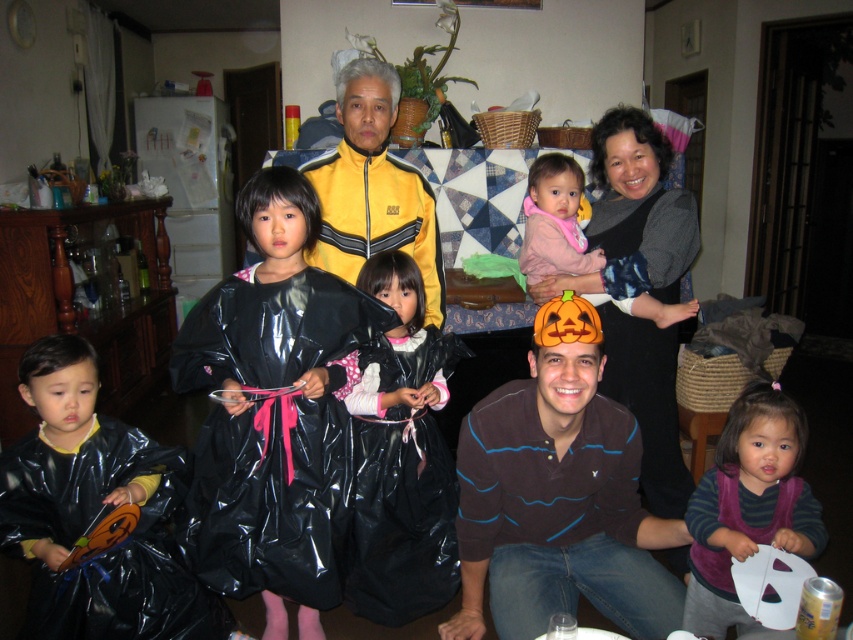
You are organizing a Halloween party and need to choose between the glossy black plastic bag at lower left and the shiny black plastic bag at center for holding candies. Which bag has a larger width?

The glossy black plastic bag at lower left has a larger width than the shiny black plastic bag at center.

You are a photographer standing 1.5 meters away from the camera. You want to take a photo of the brown striped shirt at center. Can you reach it without moving?

The brown striped shirt at center is 1.69 meters from the camera. Since you are standing 1.5 meters away from the camera, you are already close enough to reach it without moving.